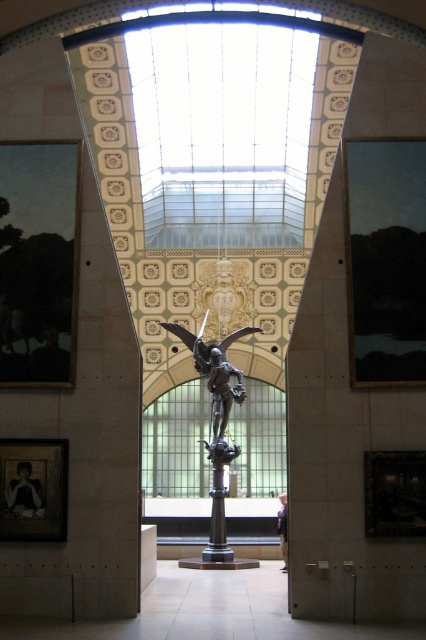
Question: Which object is farther from the camera taking this photo?

Choices:
 (A) matte black painting at left
 (B) bronze statue at center
 (C) matte black picture frame at lower left

Answer: (B)

Question: Can you confirm if dark matte painting at right is positioned to the left of matte black picture frame at lower left?

Choices:
 (A) no
 (B) yes

Answer: (A)

Question: Considering the real-world distances, which object is farthest from the matte black painting at left?

Choices:
 (A) dark matte painting at right
 (B) matte black picture frame at lower left

Answer: (A)

Question: Which object appears farthest from the camera in this image?

Choices:
 (A) bronze statue at center
 (B) wooden picture frame at lower right

Answer: (A)

Question: Does matte black painting at left appear under dark matte painting at right?

Choices:
 (A) no
 (B) yes

Answer: (B)

Question: Can you confirm if matte black painting at left is positioned below matte black picture frame at lower left?

Choices:
 (A) no
 (B) yes

Answer: (A)